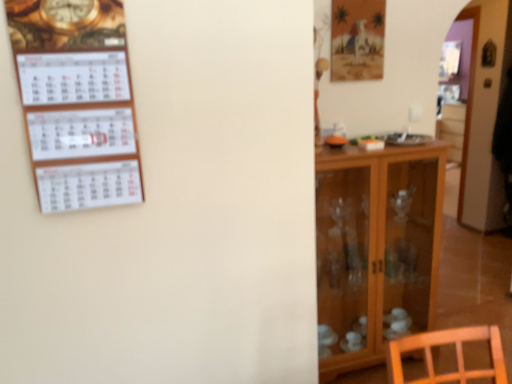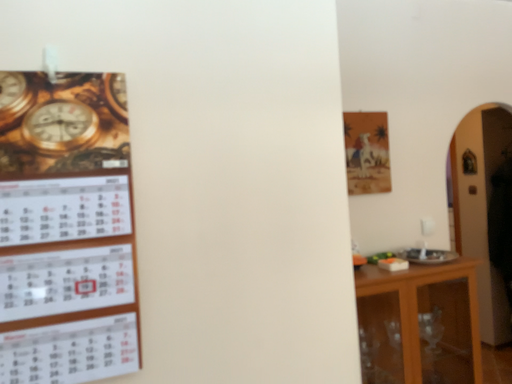
Question: How did the camera likely rotate when shooting the video?

Choices:
 (A) rotated downward
 (B) rotated upward

Answer: (B)